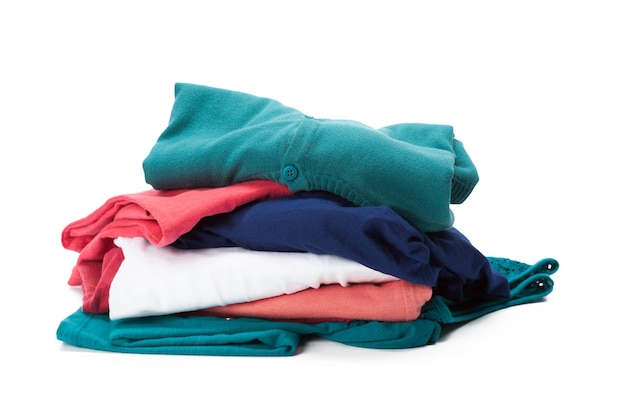
At what (x,y) coordinates should I click in order to perform the action: click on stacked partially folded apparel items in varying colors. Please return your answer as a coordinate pair (x, y). Looking at the image, I should click on (342, 177), (190, 205), (267, 227), (243, 260), (342, 298), (377, 335).